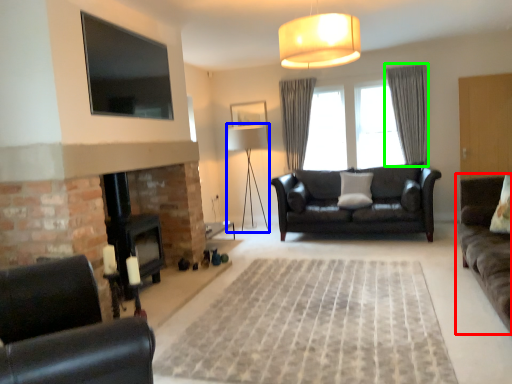
Question: Which is farther away from studio couch (highlighted by a red box)? lamp (highlighted by a blue box) or curtain (highlighted by a green box)?

Choices:
 (A) lamp
 (B) curtain

Answer: (A)